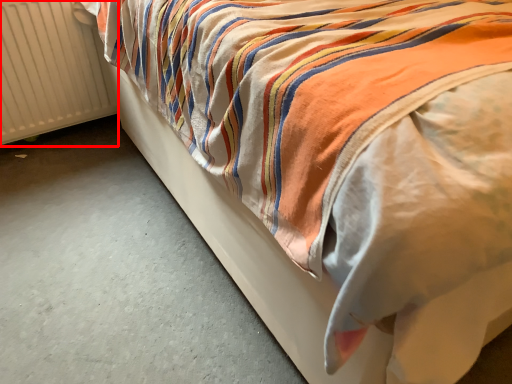
Question: From the image's perspective, what is the correct spatial relationship of radiator (annotated by the red box) in relation to concrete?

Choices:
 (A) below
 (B) above

Answer: (B)